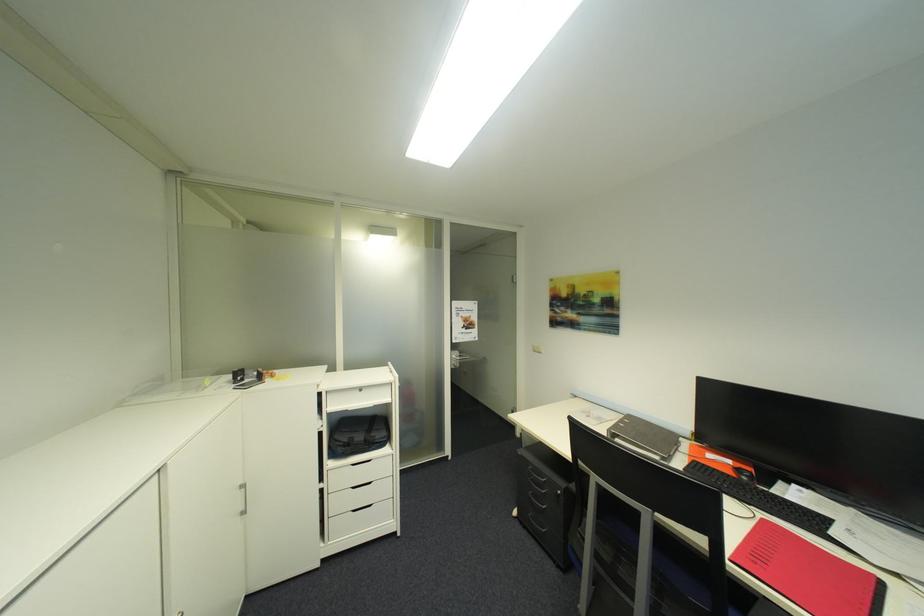
The width and height of the screenshot is (924, 616). What do you see at coordinates (244, 498) in the screenshot?
I see `a glass door handle` at bounding box center [244, 498].